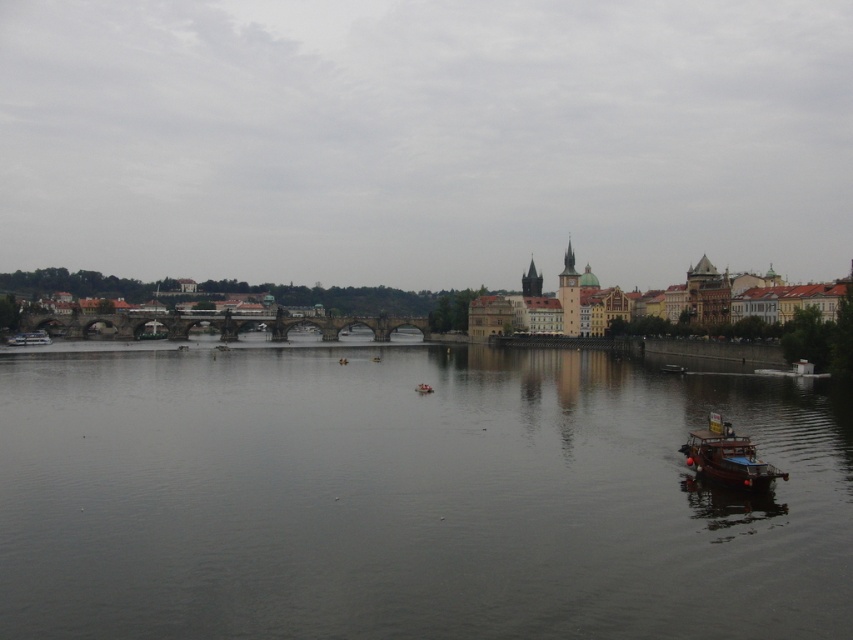
You are standing at the center of the stone bridge with multiple arches. You see a wooden boat at lower right. Where is the point located at coordinate point (727, 456)? Is it on the wooden boat at lower right or somewhere else?

The point located at coordinate point (727, 456) is on the wooden boat at lower right.

You are a tour guide leading a group along the riverside path. You notice two wooden boats in the scene. The first is the wooden boat at lower right, and the second is the wooden boat at left. Your group wants to take a photo with both boats in the frame. Considering the distance between them, do you think it is possible to capture both boats in a single photo without moving the camera position?

The wooden boat at lower right is 165.71 meters away from the wooden boat at left. Since the distance between them is quite large, it may be challenging to capture both boats in a single photo without moving the camera position unless using a wide angle lens or a high zoom level.